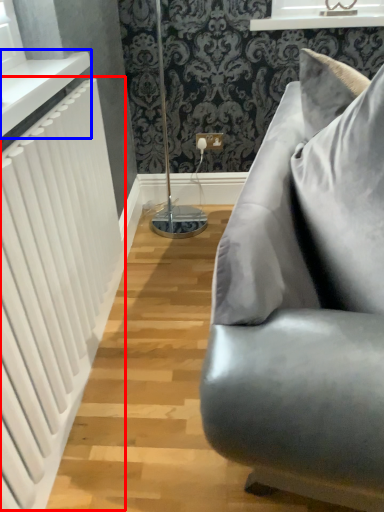
Question: Which object is further to the camera taking this photo, radiator (highlighted by a red box) or window sill (highlighted by a blue box)?

Choices:
 (A) radiator
 (B) window sill

Answer: (B)